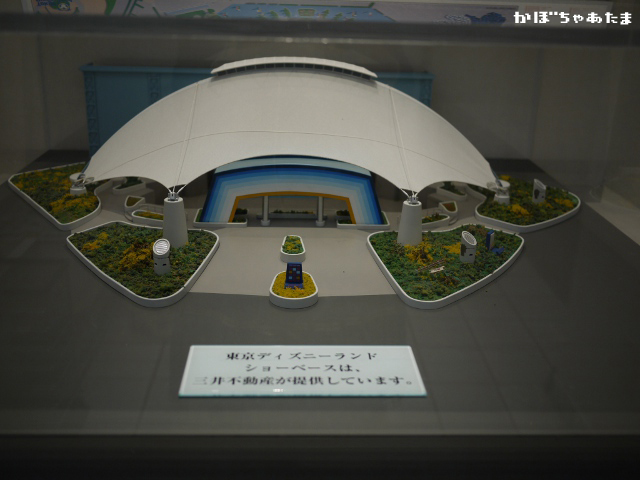
I want to click on blue and green poster, so click(339, 13).